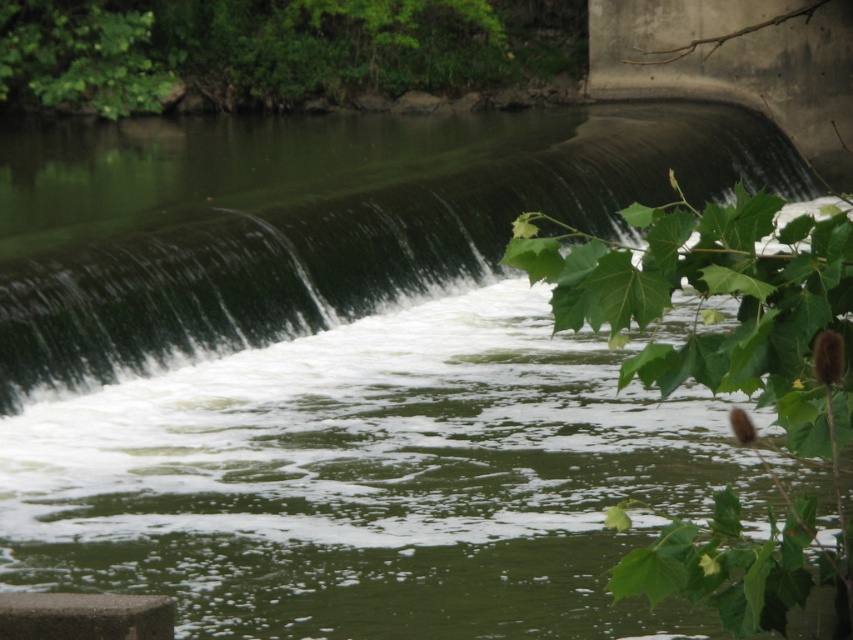
Measure the distance between point (271, 160) and camera.

Point (271, 160) and camera are 26.05 meters apart from each other.

Is green smooth water at center taller than green leafy plant at upper right?

Correct, green smooth water at center is much taller as green leafy plant at upper right.

This screenshot has width=853, height=640. Describe the element at coordinates (311, 218) in the screenshot. I see `green smooth water at center` at that location.

The width and height of the screenshot is (853, 640). I want to click on green smooth water at center, so click(x=311, y=218).